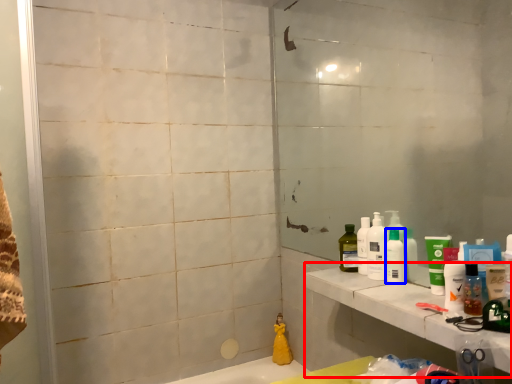
Question: Among these objects, which one is farthest to the camera, counter top (highlighted by a red box) or toiletry (highlighted by a blue box)?

Choices:
 (A) counter top
 (B) toiletry

Answer: (B)